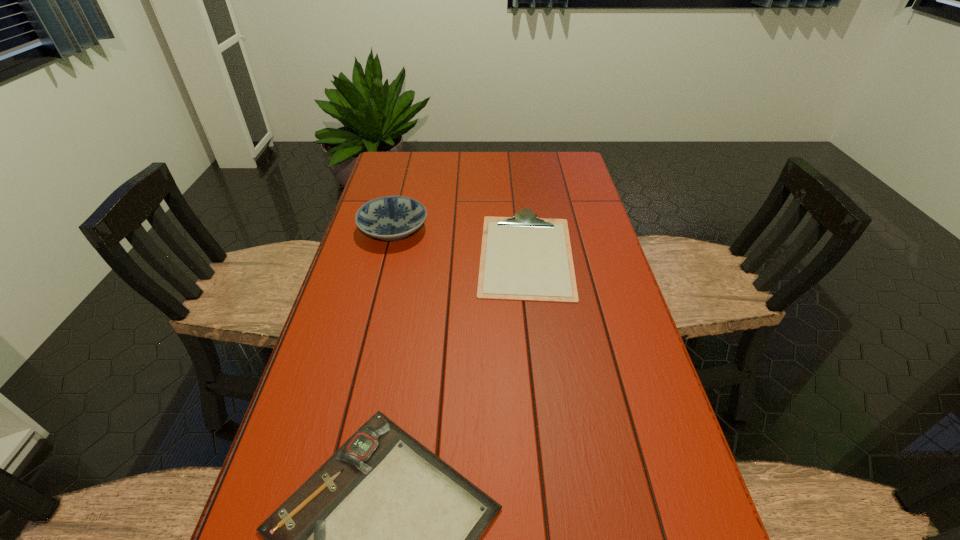
Locate an element on the screen. The width and height of the screenshot is (960, 540). vacant space at the far left corner of the desktop is located at coordinates 378,172.

In the image, there is a desktop. Where is `blank space at the far right corner`? blank space at the far right corner is located at coordinates (566, 154).

You are a GUI agent. You are given a task and a screenshot of the screen. Output one action in this format:
    pyautogui.click(x=<x>, y=<y>)
    Task: Click on the empty space that is in between the tallest object and the second shortest object
    The width and height of the screenshot is (960, 540).
    Given the screenshot: What is the action you would take?
    pyautogui.click(x=460, y=241)

At what (x,y) coordinates should I click in order to perform the action: click on vacant region between the farther clipboard and the plate. Please return your answer as a coordinate pair (x, y). Image resolution: width=960 pixels, height=540 pixels. Looking at the image, I should click on (460, 241).

This screenshot has width=960, height=540. Identify the location of vacant area that lies between the second tallest object and the plate. (460, 241).

Find the location of a particular element. This screenshot has width=960, height=540. free spot between the second tallest object and the tallest object is located at coordinates (460, 241).

Identify the location of object that can be found as the second closest to the farther clipboard. (383, 539).

Identify the location of object that can be found as the second closest to the plate. (383, 539).